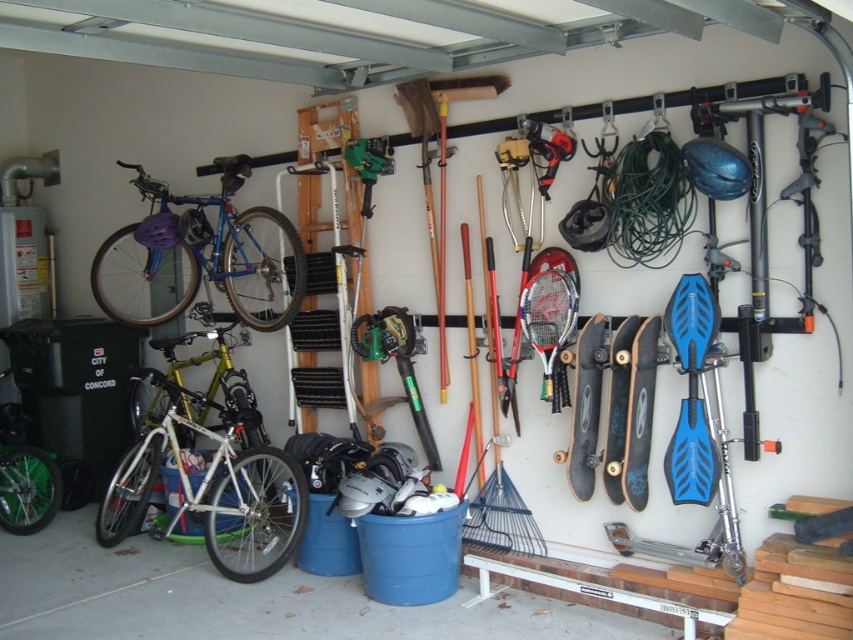
Question: Which of the following is the closest to the observer?

Choices:
 (A) blue matte bicycle at upper left
 (B) green plastic chainsaw at center
 (C) white matte bicycle at left

Answer: (C)

Question: Can you confirm if white matte bicycle at left is positioned to the left of green plastic chainsaw at center?

Choices:
 (A) no
 (B) yes

Answer: (B)

Question: Which point is closer to the camera?

Choices:
 (A) white matte bicycle at left
 (B) green plastic chainsaw at center

Answer: (A)

Question: In this image, where is white matte bicycle at left located relative to blue matte bicycle at upper left?

Choices:
 (A) below
 (B) above

Answer: (A)

Question: Among these objects, which one is farthest from the camera?

Choices:
 (A) white matte bicycle at left
 (B) green plastic chainsaw at center
 (C) blue matte bicycle at upper left

Answer: (C)

Question: Is blue matte bicycle at upper left thinner than green plastic chainsaw at center?

Choices:
 (A) no
 (B) yes

Answer: (A)